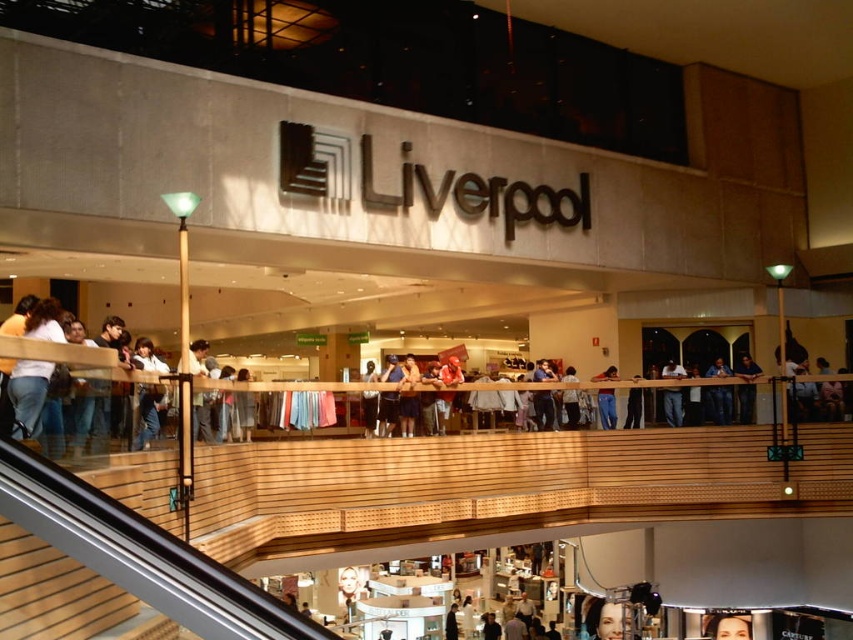
Between point (438, 385) and point (393, 392), which one is positioned behind?

The point (438, 385) is behind.

Where is `light brown wooden railing at center`? Image resolution: width=853 pixels, height=640 pixels. light brown wooden railing at center is located at coordinates (311, 381).

Can you confirm if light brown leather jacket at center is taller than dark blue jeans at center?

Correct, light brown leather jacket at center is much taller as dark blue jeans at center.

Who is shorter, light brown leather jacket at center or dark blue jeans at center?

Standing shorter between the two is dark blue jeans at center.

The width and height of the screenshot is (853, 640). Identify the location of light brown leather jacket at center. (201, 417).

Does point (26, 330) come farther from viewer compared to point (611, 378)?

That is False.

Can you confirm if light brown wooden railing at center is thinner than jeans at center?

No, light brown wooden railing at center is not thinner than jeans at center.

Measure the distance between point (671, 380) and camera.

The distance of point (671, 380) from camera is 134.55 feet.

Identify the location of light brown wooden railing at center. The height and width of the screenshot is (640, 853). (311, 381).